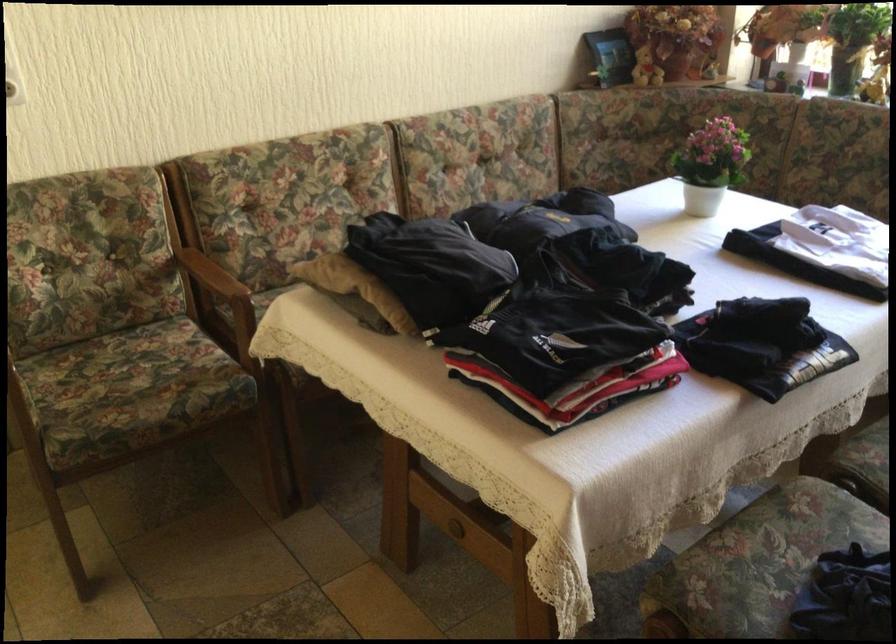
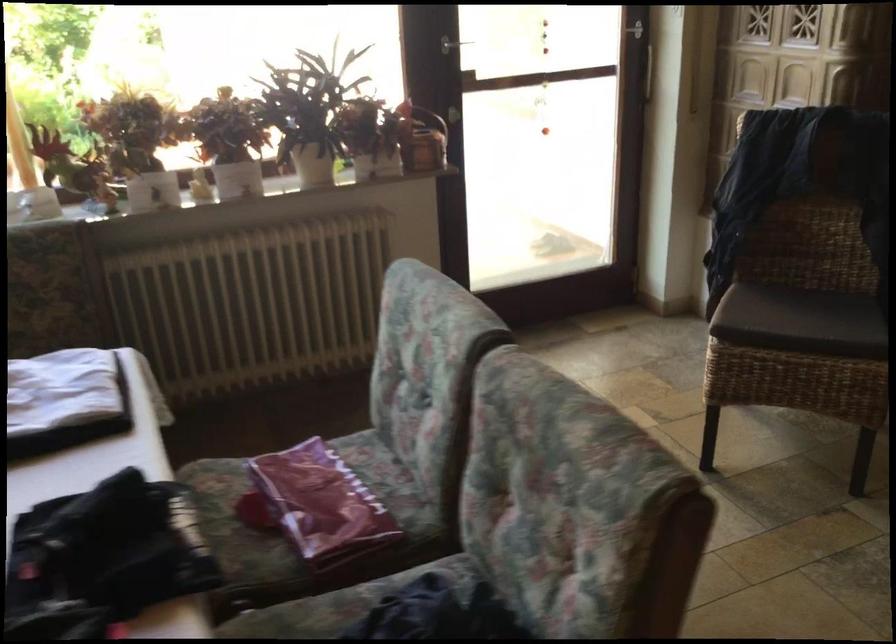
Question: The camera is either moving clockwise (left) or counter-clockwise (right) around the object. The first image is from the beginning of the video and the second image is from the end. Is the camera moving left or right when shooting the video?

Choices:
 (A) Left
 (B) Right

Answer: (A)